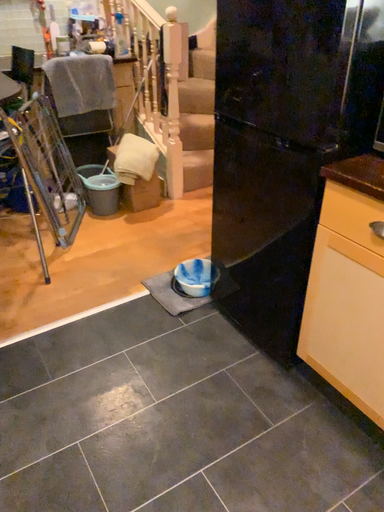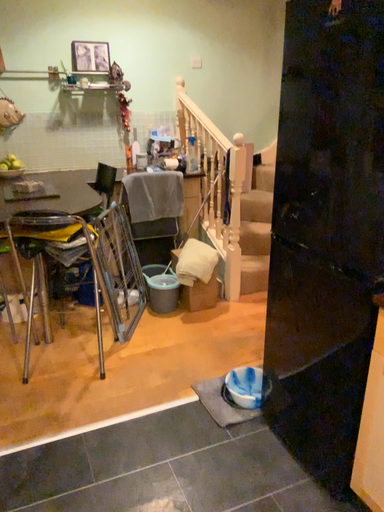
Question: How did the camera likely rotate when shooting the video?

Choices:
 (A) rotated upward
 (B) rotated downward

Answer: (A)